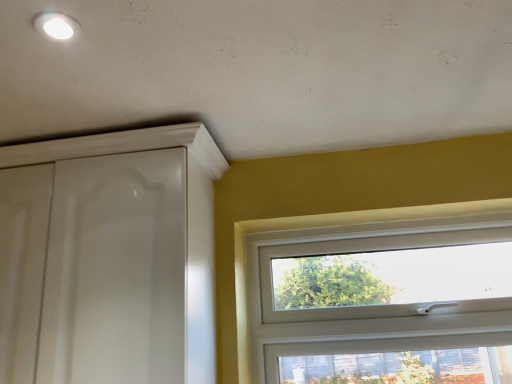
Question: Looking at their shapes, would you say white plastic window at center is wider or thinner than white glossy cabinet at upper left?

Choices:
 (A) wide
 (B) thin

Answer: (B)

Question: From a real-world perspective, relative to white glossy cabinet at upper left, is white plastic window at center vertically above or below?

Choices:
 (A) below
 (B) above

Answer: (A)

Question: Does point (344, 324) appear closer or farther from the camera than point (133, 317)?

Choices:
 (A) closer
 (B) farther

Answer: (B)

Question: Is white glossy cabinet at upper left wider or thinner than white plastic window at center?

Choices:
 (A) wide
 (B) thin

Answer: (A)

Question: Is point (179, 344) closer or farther from the camera than point (401, 226)?

Choices:
 (A) farther
 (B) closer

Answer: (B)

Question: Is white glossy cabinet at upper left bigger or smaller than white plastic window at center?

Choices:
 (A) big
 (B) small

Answer: (A)

Question: From a real-world perspective, is white glossy cabinet at upper left above or below white plastic window at center?

Choices:
 (A) below
 (B) above

Answer: (B)